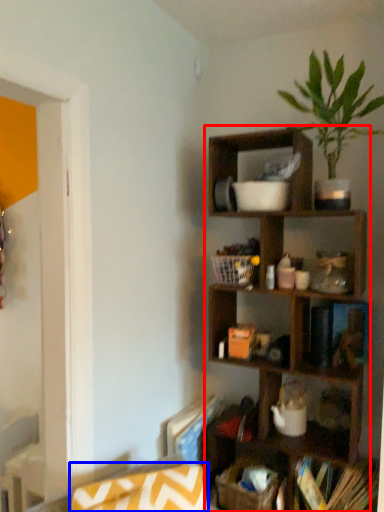
Question: Among these objects, which one is farthest to the camera, shelf (highlighted by a red box) or swivel chair (highlighted by a blue box)?

Choices:
 (A) shelf
 (B) swivel chair

Answer: (A)